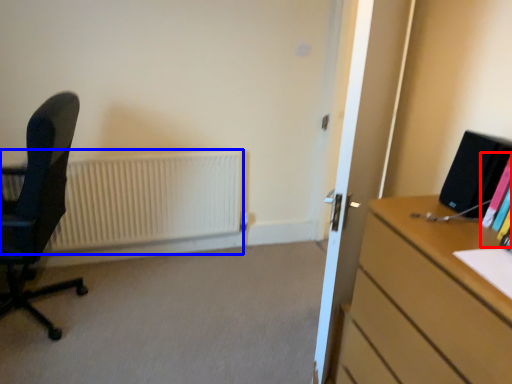
Question: Which point is closer to the camera, book (highlighted by a red box) or radiator (highlighted by a blue box)?

Choices:
 (A) book
 (B) radiator

Answer: (A)